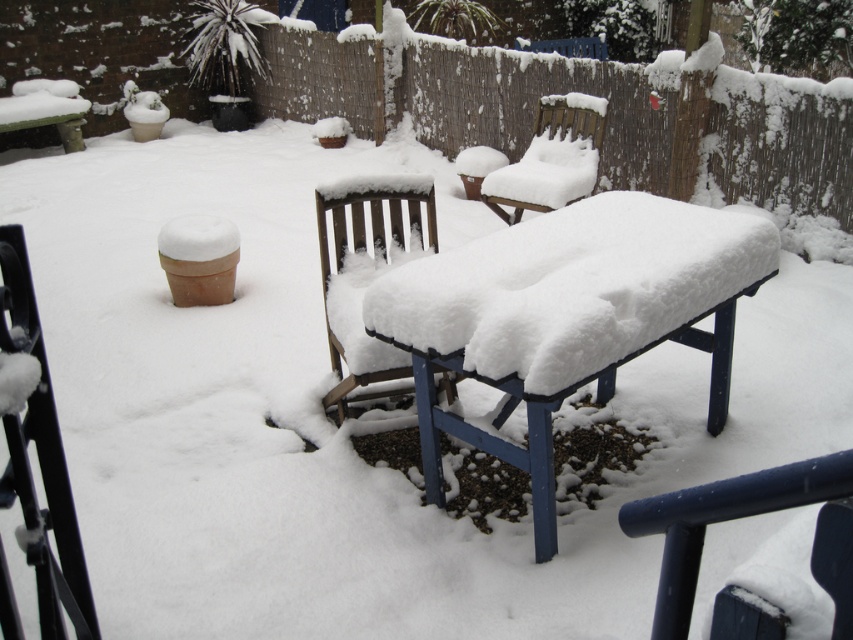
You are standing in the snowy backyard and want to take a photo of the two points mentioned. Which point, point (x=22, y=449) or point (x=540, y=154), will appear larger in your camera view?

Point (x=22, y=449) is closer to the camera than point (x=540, y=154), so it will appear larger in the photo.